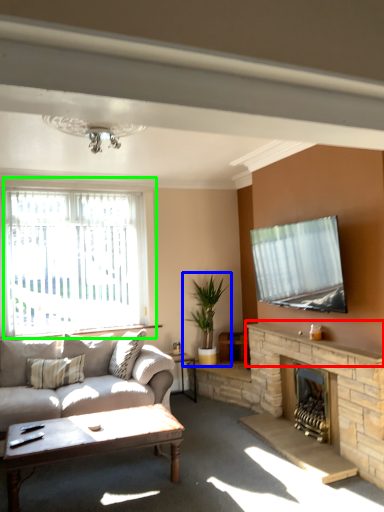
Question: Considering the real-world distances, which object is farthest from mantle (highlighted by a red box)? houseplant (highlighted by a blue box) or window (highlighted by a green box)?

Choices:
 (A) houseplant
 (B) window

Answer: (B)